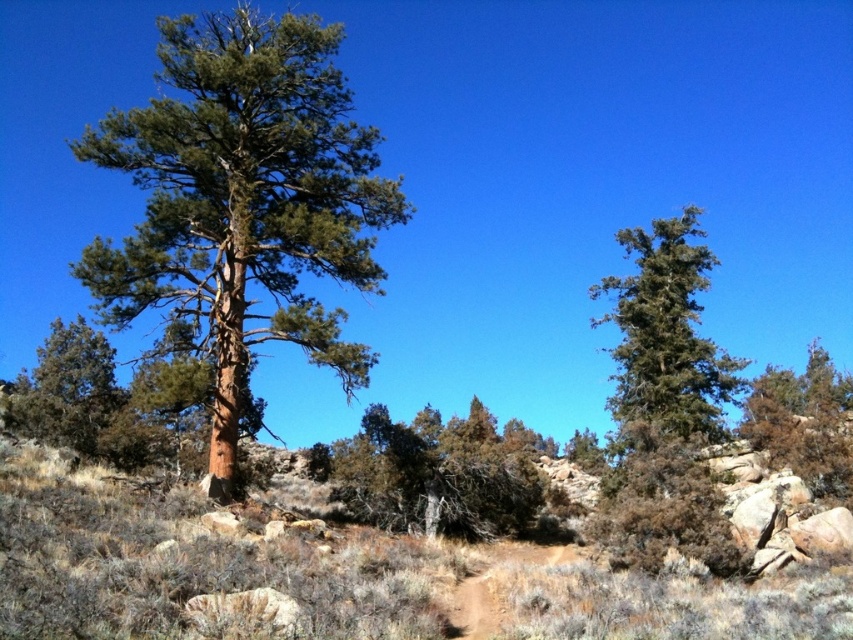
Does point (538, 436) come closer to viewer compared to point (668, 381)?

No.

Is point (343, 451) farther from camera compared to point (643, 422)?

No.

At what (x,y) coordinates should I click in order to perform the action: click on brown/dry shrub at center. Please return your answer as a coordinate pair (x, y). The width and height of the screenshot is (853, 640). Looking at the image, I should click on (433, 474).

What do you see at coordinates (804, 422) in the screenshot? I see `green rough bark tree at right` at bounding box center [804, 422].

Is green rough bark tree at right below brown dirt track at center?

No.

I want to click on green rough bark tree at right, so click(804, 422).

Locate an element on the screen. green rough bark tree at right is located at coordinates (804, 422).

Does point (248, 77) come in front of point (535, 557)?

That is True.

Is green rough bark tree at left smaller than brown dirt track at center?

No, green rough bark tree at left is not smaller than brown dirt track at center.

At what (x,y) coordinates should I click in order to perform the action: click on green rough bark tree at left. Please return your answer as a coordinate pair (x, y). Looking at the image, I should click on (242, 200).